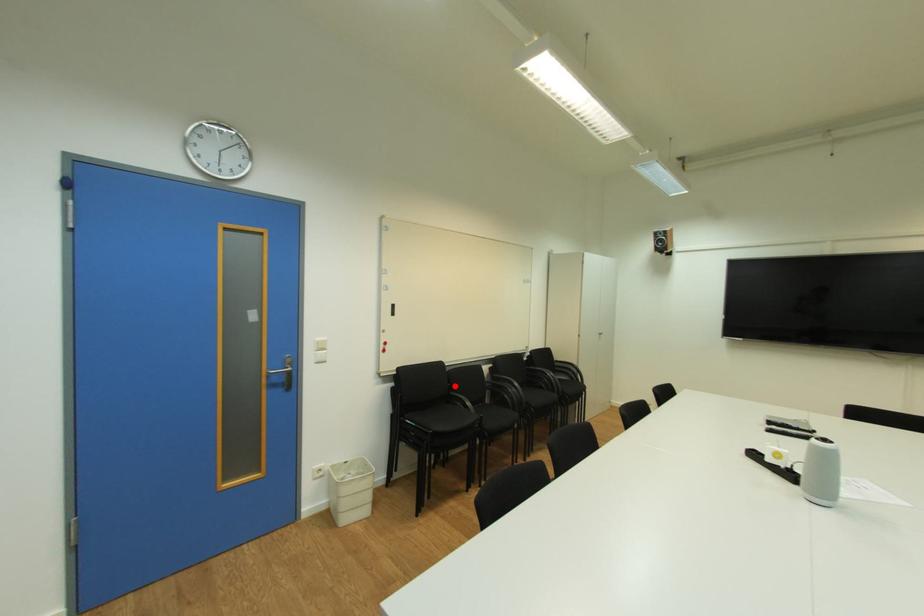
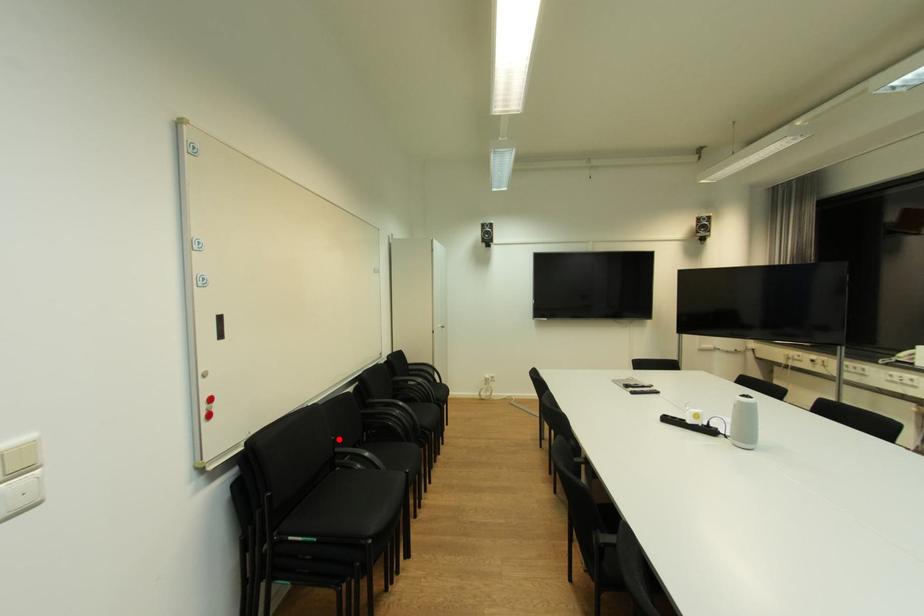
I am providing you with two images of the same scene from different viewpoints. A red point is marked on the first image and another point is marked on the second image. Is the red point in image1 aligned with the point shown in image2?

Yes